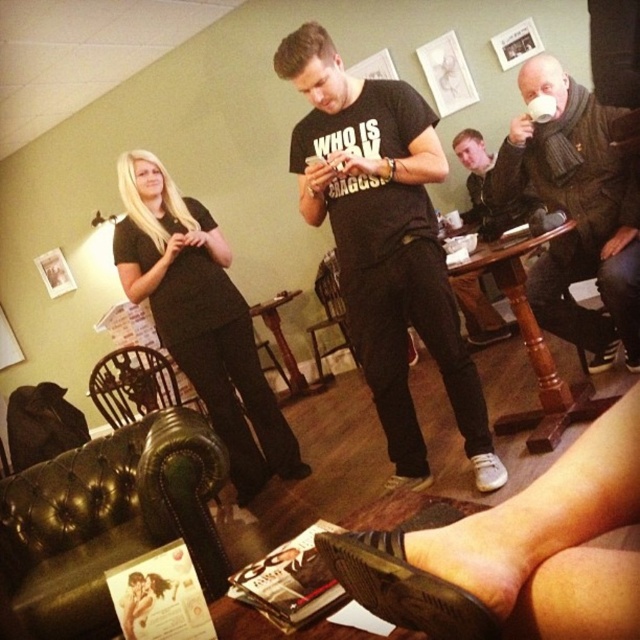
You are standing in the lounge and want to place a 2.0 meter long banner between yourself and the point at coordinates point (333, 177). Will the banner fit without bending or overlapping?

The distance between you and the point (333, 177) is 1.98 meters, which is slightly shorter than the banner length of 2.0 meters. Therefore, the banner will not fit without bending or overlapping.

You are planning to host a small gathering and need to seat two guests. You have a green leather armchair at lower left and a wooden chair at lower left available. Which chair would be more suitable for a guest who prefers more space?

The wooden chair at lower left is more suitable because it has a greater width than the green leather armchair at lower left, providing more space for the guest.

You are planning to host a guest who prefers seating with a smaller footprint. Which chair between the green leather armchair at lower left and the wooden chair at lower left would you recommend?

The green leather armchair at lower left is smaller than the wooden chair at lower left, so it would be the better choice for seating with a smaller footprint.